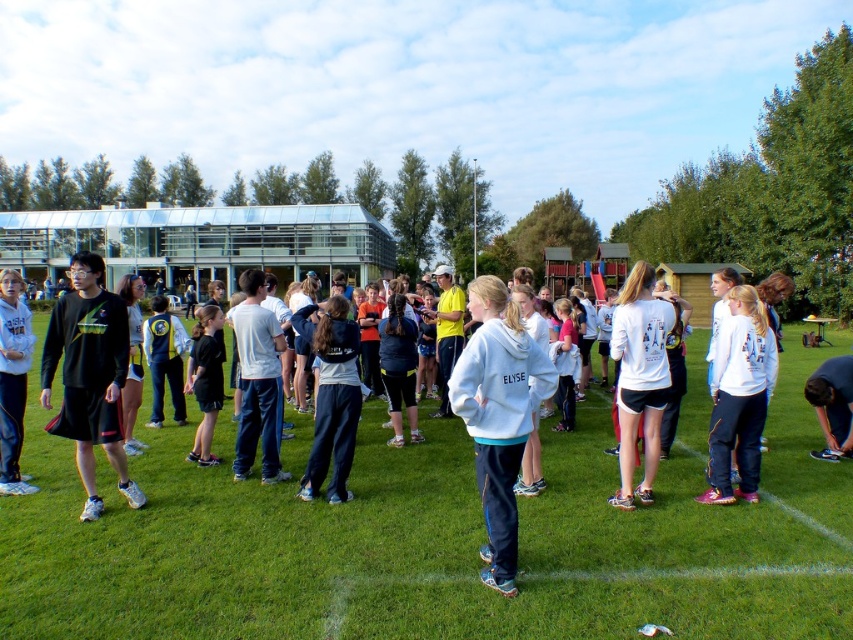
Identify the location of green grass at center. This screenshot has height=640, width=853. (438, 540).

Does green grass at center appear over black matte shorts at center?

Incorrect, green grass at center is not positioned above black matte shorts at center.

You are a GUI agent. You are given a task and a screenshot of the screen. Output one action in this format:
    pyautogui.click(x=<x>, y=<y>)
    Task: Click on the green grass at center
    The width and height of the screenshot is (853, 640).
    Given the screenshot: What is the action you would take?
    pyautogui.click(x=438, y=540)

Who is more forward, (x=602, y=394) or (x=10, y=493)?

Point (x=10, y=493) is in front.

Can you confirm if green grass at center is smaller than white fleece jacket at center?

Actually, green grass at center might be larger than white fleece jacket at center.

Where is `green grass at center`? green grass at center is located at coordinates (438, 540).

Find the location of a particular element. green grass at center is located at coordinates (438, 540).

Can you confirm if green grass at center is smaller than black matte long-sleeve shirt at center?

Incorrect, green grass at center is not smaller in size than black matte long-sleeve shirt at center.

Is point (231, 500) less distant than point (88, 333)?

No, (231, 500) is behind (88, 333).

The width and height of the screenshot is (853, 640). I want to click on green grass at center, so click(438, 540).